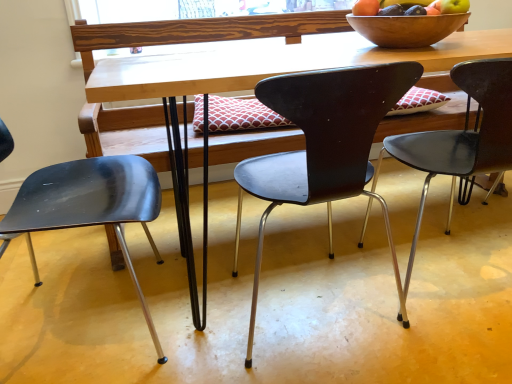
This screenshot has width=512, height=384. Identify the location of unoccupied area behind matte black chair at center, marked as the 2th chair in a right-to-left arrangement. pos(291,233).